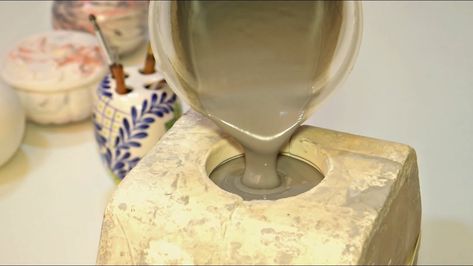
I want to click on white wall, so click(x=416, y=97).